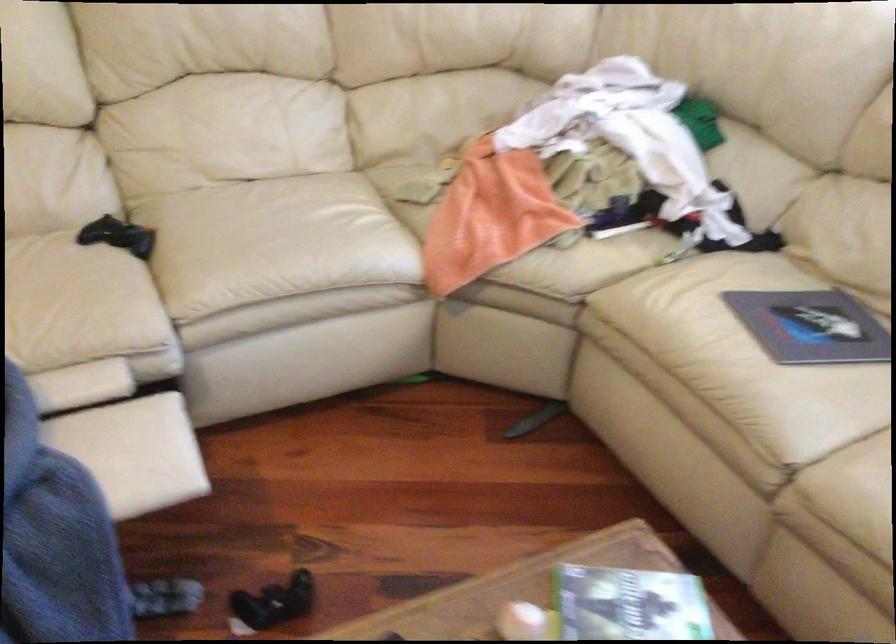
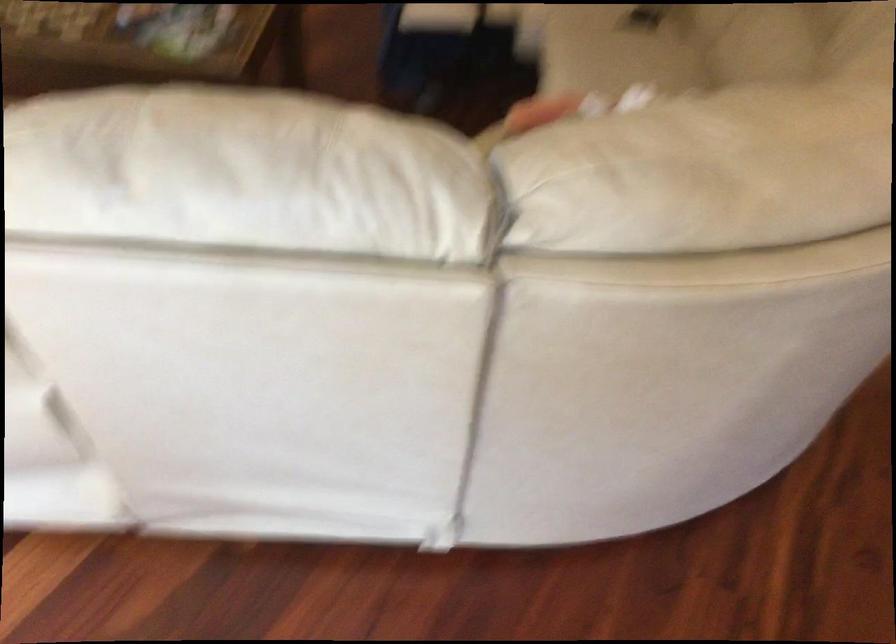
Find the pixel in the second image that matches pixel 280 228 in the first image.

(616, 49)